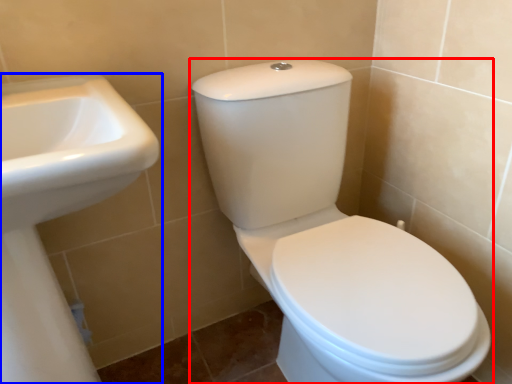
Question: Which object is further to the camera taking this photo, toilet (highlighted by a red box) or sink (highlighted by a blue box)?

Choices:
 (A) toilet
 (B) sink

Answer: (A)